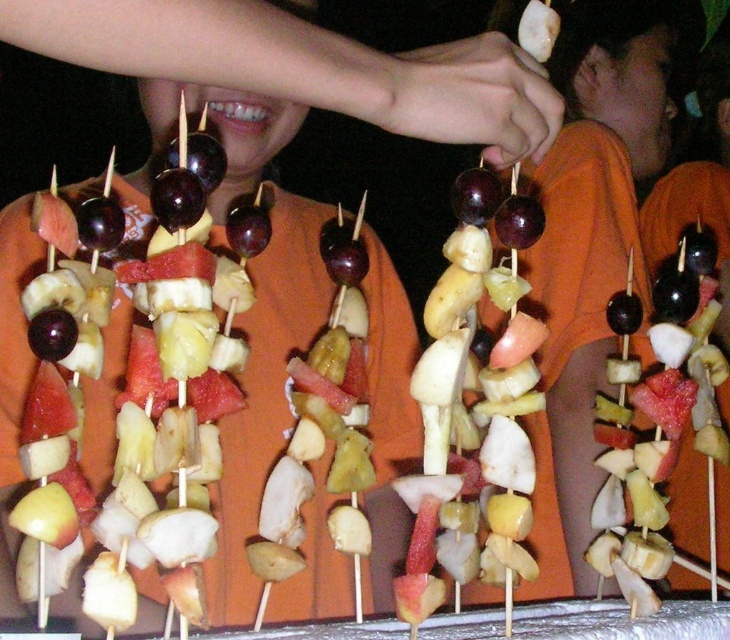
Between point (588, 397) and point (680, 384), which one is positioned in front?

Point (680, 384) is more forward.

Which of these two, orange cotton shirt at center or shiny red watermelon at center, stands shorter?

shiny red watermelon at center

Is point (612, 52) behind point (683, 321)?

Yes, point (612, 52) is behind point (683, 321).

I want to click on orange cotton shirt at center, so click(593, 221).

The height and width of the screenshot is (640, 730). In order to click on glossy wooden skewer with assorted fruits at center in this screenshot , I will do `click(474, 408)`.

Which is more to the right, glossy wooden skewer with assorted fruits at center or shiny red watermelon at center?

From the viewer's perspective, shiny red watermelon at center appears more on the right side.

The height and width of the screenshot is (640, 730). What are the coordinates of `glossy wooden skewer with assorted fruits at center` in the screenshot? It's located at (474, 408).

Identify the location of glossy wooden skewer with assorted fruits at center. (474, 408).

Is orange cotton shirt at center further to the viewer compared to glossy wooden skewer with assorted fruits at center?

Yes, orange cotton shirt at center is further from the viewer.

Is orange cotton shirt at center below glossy wooden skewer with assorted fruits at center?

No, orange cotton shirt at center is not below glossy wooden skewer with assorted fruits at center.

What do you see at coordinates (593, 221) in the screenshot? Image resolution: width=730 pixels, height=640 pixels. I see `orange cotton shirt at center` at bounding box center [593, 221].

This screenshot has height=640, width=730. In order to click on orange cotton shirt at center in this screenshot , I will do `click(593, 221)`.